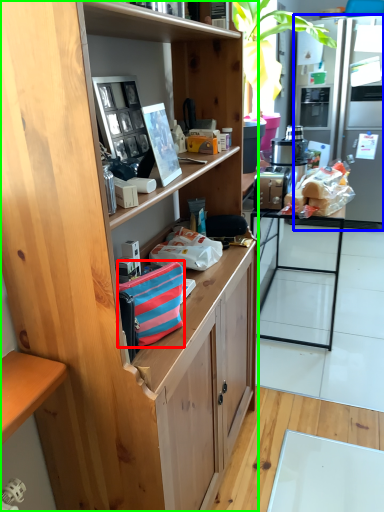
Question: Which object is the farthest from handbag (highlighted by a red box)? Choose among these: refrigerator (highlighted by a blue box) or cabinetry (highlighted by a green box).

Choices:
 (A) refrigerator
 (B) cabinetry

Answer: (A)